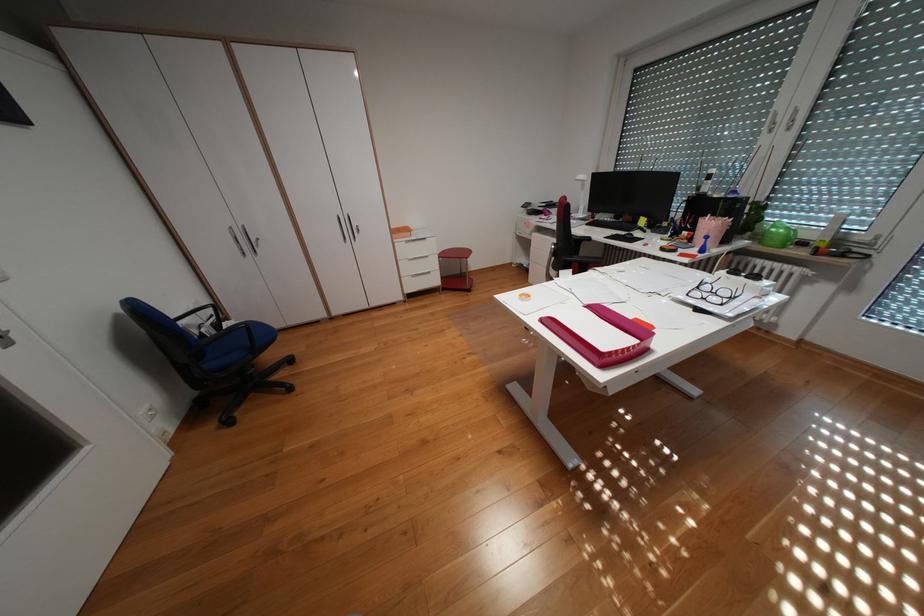
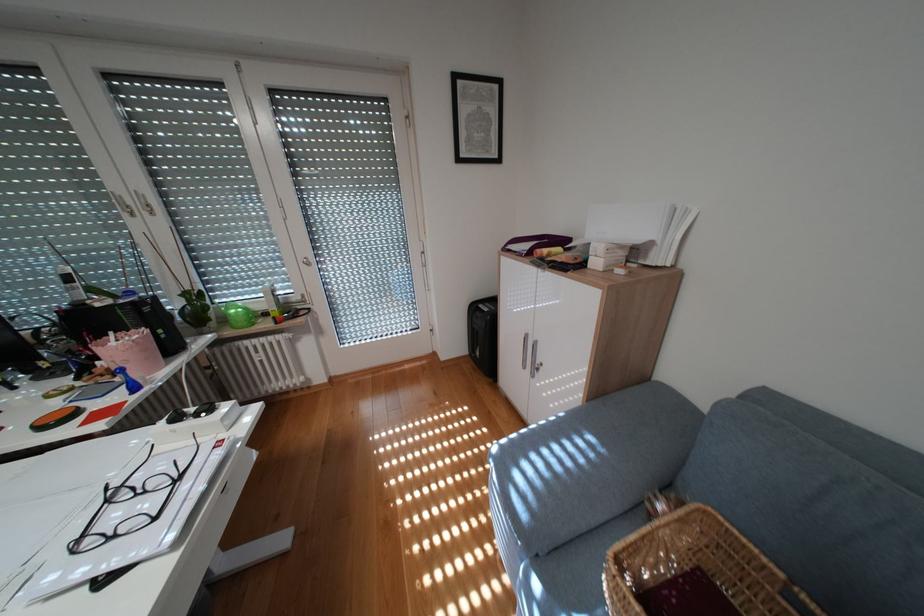
Find the pixel in the second image that matches (x=723, y=224) in the first image.

(136, 345)